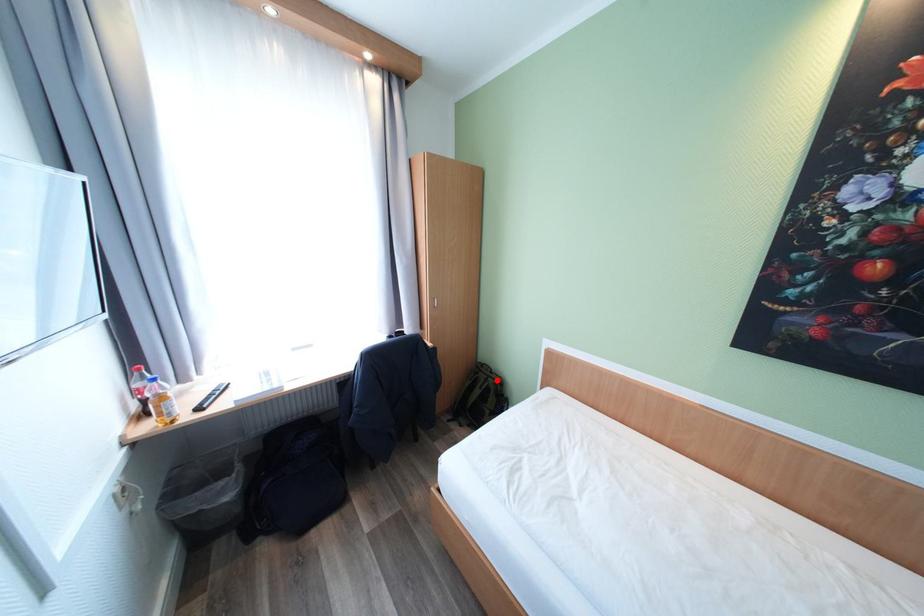
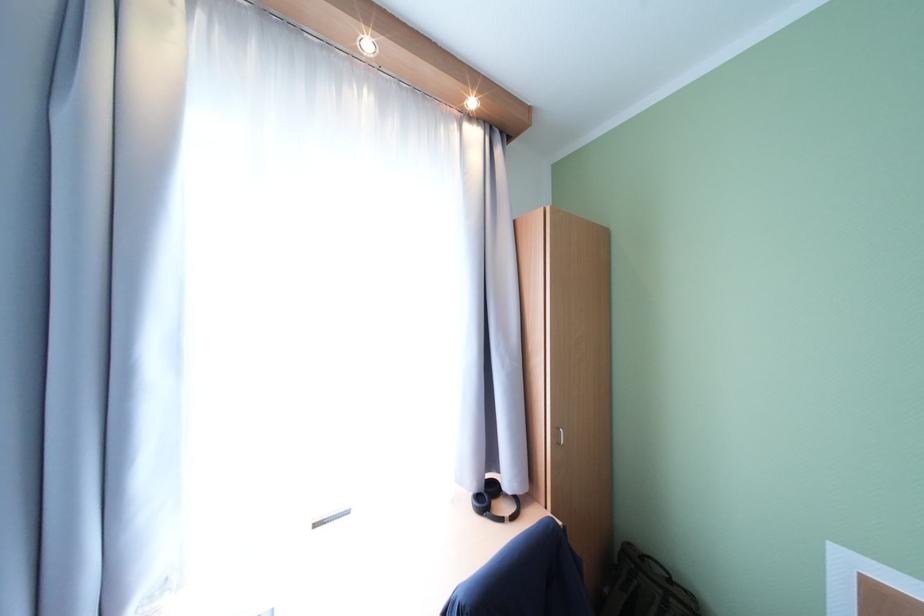
Question: I am providing you with two images of the same scene from different viewpoints. Image1 has a red point marked. In image2, the corresponding 3D location appears at what relative position? Reply with the corresponding letter.

Choices:
 (A) Closer
 (B) Farther

Answer: (A)